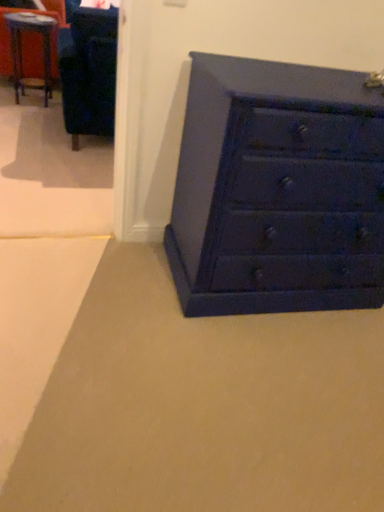
Question: In the image, is metallic blue table at upper left positioned in front of or behind velvet blue armchair at upper left?

Choices:
 (A) behind
 (B) front

Answer: (A)

Question: Is metallic blue table at upper left inside or outside of velvet blue armchair at upper left?

Choices:
 (A) inside
 (B) outside

Answer: (B)

Question: Which object is the closest to the metallic blue table at upper left?

Choices:
 (A) matte blue chest of drawers at lower right
 (B) velvet blue armchair at upper left

Answer: (B)

Question: Considering the real-world distances, which object is farthest from the matte blue chest of drawers at lower right?

Choices:
 (A) velvet blue armchair at upper left
 (B) metallic blue table at upper left

Answer: (B)